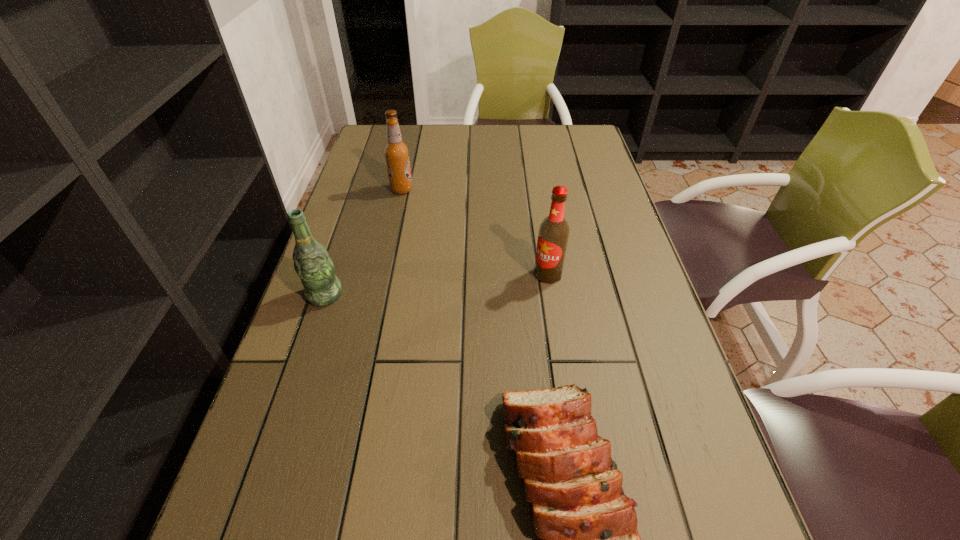
Locate an element on the screen. The height and width of the screenshot is (540, 960). free spot that satisfies the following two spatial constraints: 1. on the front label of the third object from right to left; 2. on the surface of the leftmost beer bottle is located at coordinates (378, 295).

I want to click on vacant space that satisfies the following two spatial constraints: 1. on the front label of the farthest object; 2. on the back side of the rightmost beer bottle, so click(383, 274).

This screenshot has width=960, height=540. What are the coordinates of `vacant space that satisfies the following two spatial constraints: 1. on the front label of the rightmost beer bottle; 2. on the left side of the third object from right to left` in the screenshot? It's located at (383, 274).

Find the location of a particular element. Image resolution: width=960 pixels, height=540 pixels. vacant area in the image that satisfies the following two spatial constraints: 1. on the front label of the farthest object; 2. on the left side of the rightmost beer bottle is located at coordinates (383, 274).